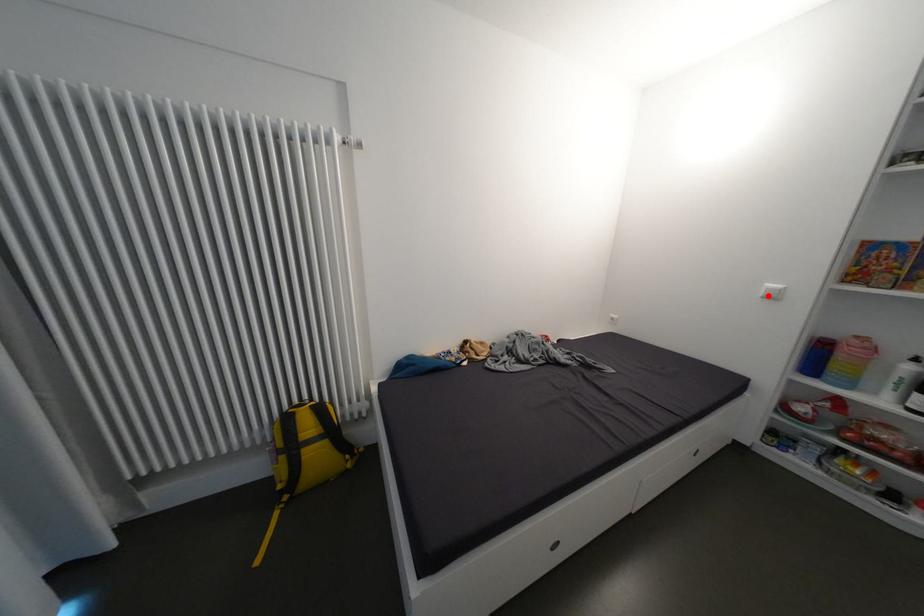
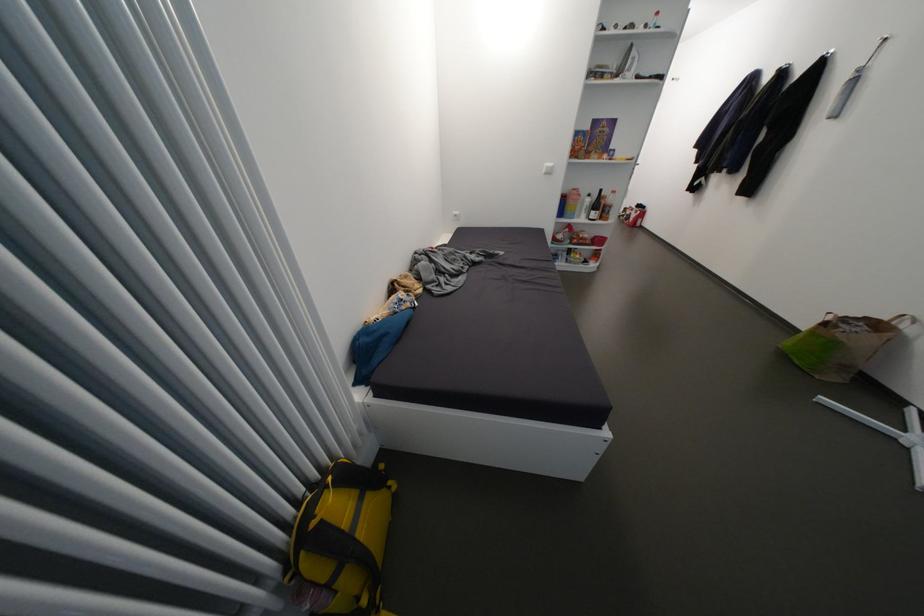
Question: I am providing you with two images of the same scene from different viewpoints. A red point is marked on the first image. Can you still see the location of the red point in image 2?

Choices:
 (A) Yes
 (B) No

Answer: (A)